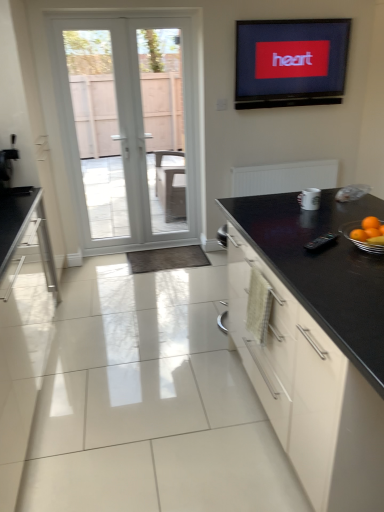
Question: Are flat screen tv at upper center and white ceramic mug at upper right, which is the 2th appliance in bottom-to-top order, making contact?

Choices:
 (A) yes
 (B) no

Answer: (B)

Question: Is flat screen tv at upper center wider than white ceramic mug at upper right, positioned as the first appliance in top-to-bottom order?

Choices:
 (A) yes
 (B) no

Answer: (B)

Question: From the image's perspective, is flat screen tv at upper center located beneath white ceramic mug at upper right, which is the second appliance from front to back?

Choices:
 (A) yes
 (B) no

Answer: (B)

Question: From the image's perspective, is flat screen tv at upper center on top of white ceramic mug at upper right, positioned as the first appliance in top-to-bottom order?

Choices:
 (A) yes
 (B) no

Answer: (A)

Question: Does flat screen tv at upper center have a larger size compared to white ceramic mug at upper right, which ranks as the first appliance in back-to-front order?

Choices:
 (A) yes
 (B) no

Answer: (A)

Question: Would you say black glossy cabinet at right is to the left or to the right of white ceramic mug at upper right, which ranks as the first appliance in back-to-front order, in the picture?

Choices:
 (A) right
 (B) left

Answer: (A)

Question: Do you think black glossy cabinet at right is within white ceramic mug at upper right, which ranks as the first appliance in back-to-front order, or outside of it?

Choices:
 (A) inside
 (B) outside

Answer: (B)

Question: Is black glossy cabinet at right in front of or behind white ceramic mug at upper right, which is the second appliance from front to back, in the image?

Choices:
 (A) behind
 (B) front

Answer: (B)

Question: Considering the positions of black glossy cabinet at right and white ceramic mug at upper right, which ranks as the first appliance in back-to-front order, in the image, is black glossy cabinet at right wider or thinner than white ceramic mug at upper right, which ranks as the first appliance in back-to-front order,?

Choices:
 (A) wide
 (B) thin

Answer: (A)

Question: Is point (96, 121) closer or farther from the camera than point (332, 243)?

Choices:
 (A) closer
 (B) farther

Answer: (B)

Question: Is white glass door at left to the left or to the right of black plastic remote control at center, the first appliance positioned from the front, in the image?

Choices:
 (A) right
 (B) left

Answer: (B)

Question: From the image's perspective, is white glass door at left located above or below black plastic remote control at center, the second appliance viewed from the back?

Choices:
 (A) below
 (B) above

Answer: (B)

Question: Considering their positions, is white glass door at left located in front of or behind black plastic remote control at center, placed as the first appliance when sorted from bottom to top?

Choices:
 (A) front
 (B) behind

Answer: (B)

Question: Considering the positions of black glossy cabinet at right and orange matte at right in the image, is black glossy cabinet at right taller or shorter than orange matte at right?

Choices:
 (A) tall
 (B) short

Answer: (A)

Question: Would you say black glossy cabinet at right is inside or outside orange matte at right?

Choices:
 (A) inside
 (B) outside

Answer: (B)